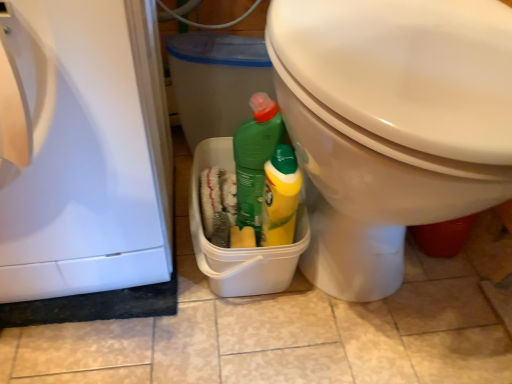
Question: Based on their positions, is white glossy dishwasher at left located to the left or right of white glossy toilet at right?

Choices:
 (A) left
 (B) right

Answer: (A)

Question: From a real-world perspective, is white glossy dishwasher at left positioned above or below white glossy toilet at right?

Choices:
 (A) below
 (B) above

Answer: (B)

Question: In terms of height, does white glossy dishwasher at left look taller or shorter compared to white glossy toilet at right?

Choices:
 (A) tall
 (B) short

Answer: (B)

Question: From their relative heights in the image, would you say white glossy toilet at right is taller or shorter than white glossy dishwasher at left?

Choices:
 (A) short
 (B) tall

Answer: (B)

Question: Is white glossy toilet at right in front of or behind white glossy dishwasher at left in the image?

Choices:
 (A) behind
 (B) front

Answer: (A)

Question: From a real-world perspective, is white glossy toilet at right positioned above or below white glossy dishwasher at left?

Choices:
 (A) above
 (B) below

Answer: (B)

Question: From the image's perspective, is white glossy toilet at right positioned above or below white glossy dishwasher at left?

Choices:
 (A) below
 (B) above

Answer: (B)